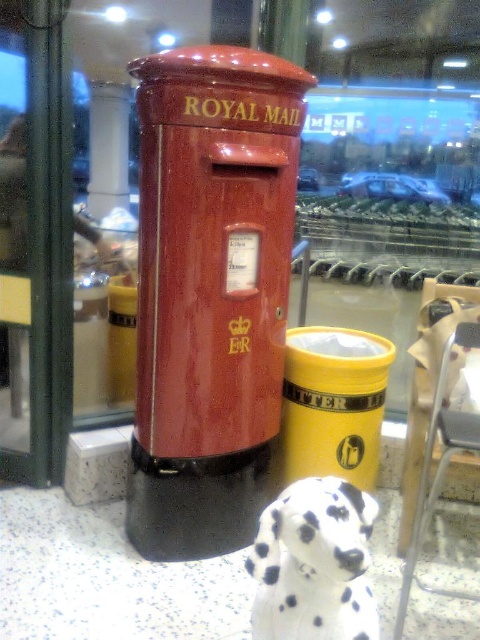
Question: Is matte red mailbox at center to the left of white-spotted fur dog at lower center from the viewer's perspective?

Choices:
 (A) no
 (B) yes

Answer: (B)

Question: Can you confirm if matte red mailbox at center is bigger than white-spotted fur dog at lower center?

Choices:
 (A) no
 (B) yes

Answer: (B)

Question: Is the position of matte red mailbox at center more distant than that of white-spotted fur dog at lower center?

Choices:
 (A) no
 (B) yes

Answer: (B)

Question: Which point is farther to the camera?

Choices:
 (A) (284, 86)
 (B) (305, 616)

Answer: (A)

Question: Which of the following is the farthest from the observer?

Choices:
 (A) white-spotted fur dog at lower center
 (B) matte red mailbox at center

Answer: (B)